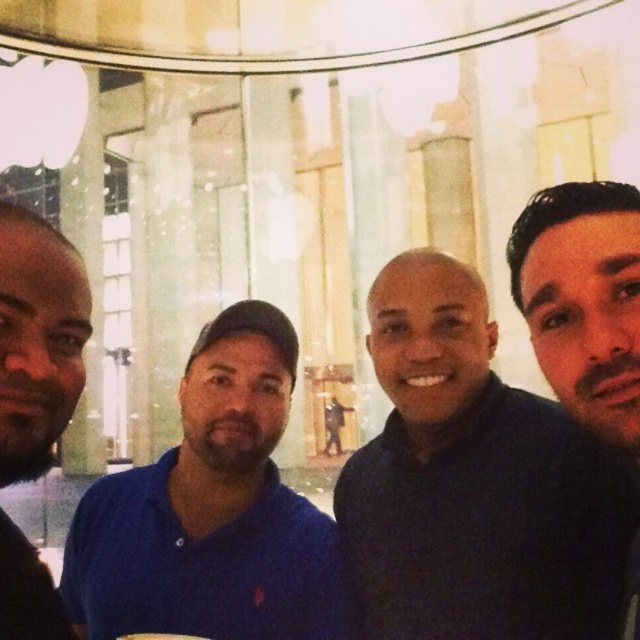
Between blue cotton polo shirt at center and dark brown hair at upper right, which one appears on the left side from the viewer's perspective?

From the viewer's perspective, blue cotton polo shirt at center appears more on the left side.

Is blue cotton polo shirt at center below dark brown hair at upper right?

Indeed, blue cotton polo shirt at center is positioned under dark brown hair at upper right.

Which is in front, point (192, 448) or point (531, 323)?

Point (531, 323) is in front.

Locate an element on the screen. blue cotton polo shirt at center is located at coordinates (211, 509).

Can you confirm if blue cotton polo shirt at center is positioned to the left of dark blue shirt at left?

In fact, blue cotton polo shirt at center is to the right of dark blue shirt at left.

Which is above, blue cotton polo shirt at center or dark blue shirt at left?

dark blue shirt at left

Is point (310, 560) positioned before point (1, 337)?

That is False.

The image size is (640, 640). I want to click on blue cotton polo shirt at center, so click(x=211, y=509).

Is dark blue sweater at center bigger than dark blue shirt at left?

Yes, dark blue sweater at center is bigger than dark blue shirt at left.

This screenshot has width=640, height=640. Find the location of `dark blue sweater at center`. dark blue sweater at center is located at coordinates (474, 483).

The image size is (640, 640). I want to click on dark blue sweater at center, so click(x=474, y=483).